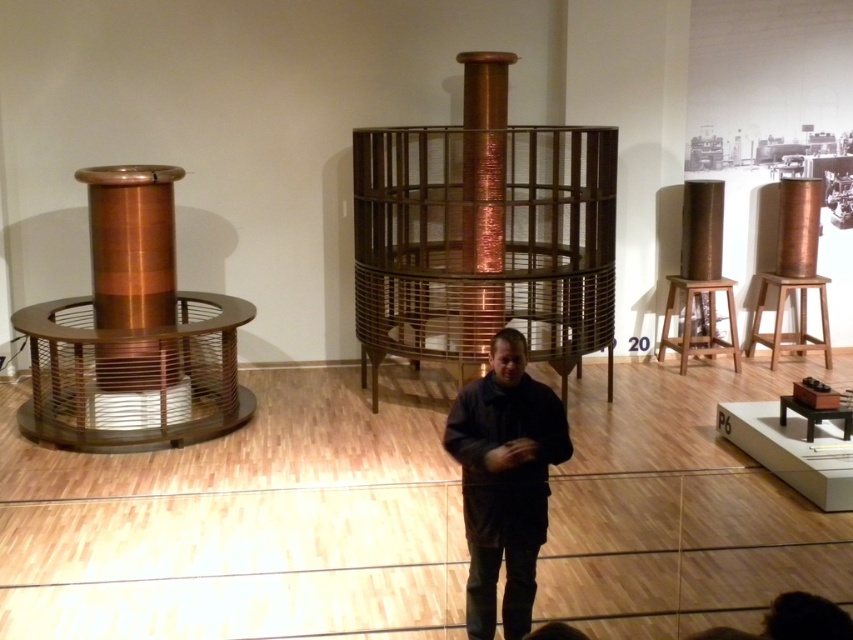
Between copper wire mesh cage at center and light brown wooden stool at right, which one appears on the left side from the viewer's perspective?

copper wire mesh cage at center

Which is more to the right, copper wire mesh cage at center or light brown wooden stool at right?

From the viewer's perspective, light brown wooden stool at right appears more on the right side.

The height and width of the screenshot is (640, 853). Identify the location of copper wire mesh cage at center. (483, 243).

Does dark matte jacket at center have a smaller size compared to light brown wooden stool at right?

Yes, dark matte jacket at center is smaller than light brown wooden stool at right.

Between dark matte jacket at center and light brown wooden stool at right, which one is positioned lower?

Positioned lower is dark matte jacket at center.

You are a GUI agent. You are given a task and a screenshot of the screen. Output one action in this format:
    pyautogui.click(x=<x>, y=<y>)
    Task: Click on the dark matte jacket at center
    Image resolution: width=853 pixels, height=640 pixels.
    Given the screenshot: What is the action you would take?
    pyautogui.click(x=503, y=481)

Consider the image. Can you confirm if light brown wooden stool at right is wider than wooden stool at right?

Incorrect, light brown wooden stool at right's width does not surpass wooden stool at right's.

Who is more forward, (697,285) or (805,352)?

Positioned in front is point (697,285).

Identify the location of light brown wooden stool at right. The width and height of the screenshot is (853, 640). (700, 317).